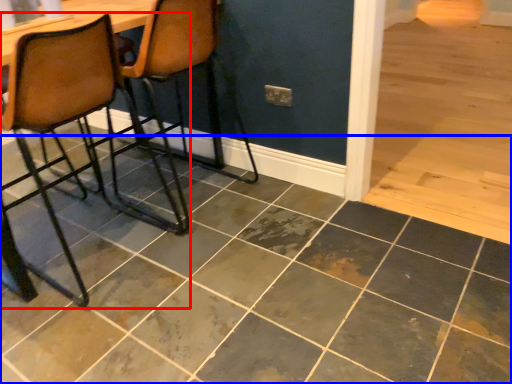
Question: Which of the following is the farthest to the observer, chair (highlighted by a red box) or ceramic tile (highlighted by a blue box)?

Choices:
 (A) chair
 (B) ceramic tile

Answer: (A)